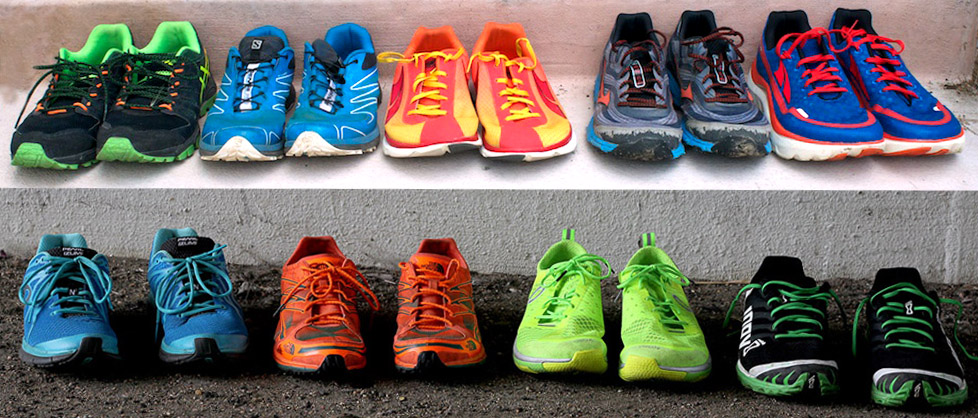
This screenshot has height=418, width=978. Identify the location of pairs of shoes. (110, 90), (284, 94), (477, 93), (682, 77), (841, 66), (830, 323), (629, 301), (183, 274), (417, 303).